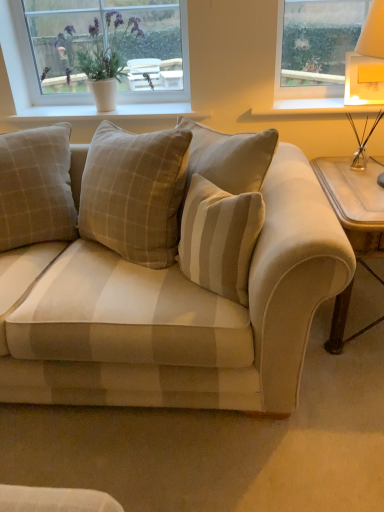
Question: Is beige plaid pillow at center to the left of beige fabric couch at center from the viewer's perspective?

Choices:
 (A) no
 (B) yes

Answer: (B)

Question: Does beige plaid pillow at center have a greater height compared to beige fabric couch at center?

Choices:
 (A) yes
 (B) no

Answer: (B)

Question: Is beige plaid pillow at center further to camera compared to beige fabric couch at center?

Choices:
 (A) no
 (B) yes

Answer: (B)

Question: Does beige plaid pillow at center appear on the right side of beige fabric couch at center?

Choices:
 (A) yes
 (B) no

Answer: (B)

Question: Is beige plaid pillow at center aimed at beige fabric couch at center?

Choices:
 (A) no
 (B) yes

Answer: (B)

Question: Which is correct: beige plaid pillow at center is inside white textured window at upper left, or outside of it?

Choices:
 (A) outside
 (B) inside

Answer: (A)

Question: From their relative heights in the image, would you say beige plaid pillow at center is taller or shorter than white textured window at upper left?

Choices:
 (A) tall
 (B) short

Answer: (A)

Question: Would you say beige plaid pillow at center is to the left or to the right of white textured window at upper left in the picture?

Choices:
 (A) left
 (B) right

Answer: (A)

Question: Based on their sizes in the image, would you say beige plaid pillow at center is bigger or smaller than white textured window at upper left?

Choices:
 (A) big
 (B) small

Answer: (A)

Question: Do you think beige fabric couch at center is within wooden side table at right, or outside of it?

Choices:
 (A) outside
 (B) inside

Answer: (A)

Question: In terms of height, does beige fabric couch at center look taller or shorter compared to wooden side table at right?

Choices:
 (A) short
 (B) tall

Answer: (B)

Question: Considering their positions, is beige fabric couch at center located in front of or behind wooden side table at right?

Choices:
 (A) front
 (B) behind

Answer: (A)

Question: From the image's perspective, relative to wooden side table at right, is beige fabric couch at center above or below?

Choices:
 (A) below
 (B) above

Answer: (B)

Question: Is point (317, 98) closer or farther from the camera than point (46, 220)?

Choices:
 (A) farther
 (B) closer

Answer: (A)

Question: From their relative heights in the image, would you say white painted wood at upper right is taller or shorter than beige plaid pillow at center?

Choices:
 (A) short
 (B) tall

Answer: (A)